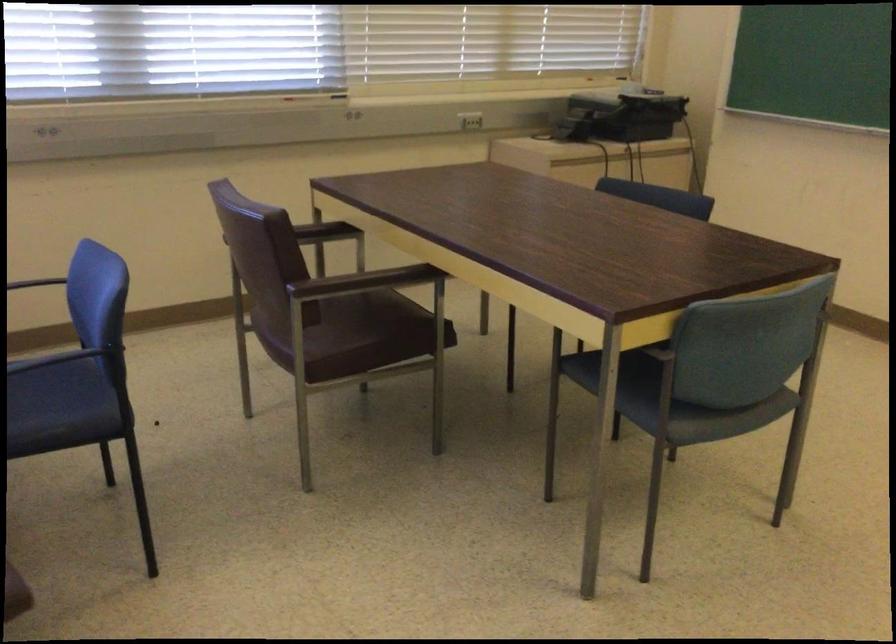
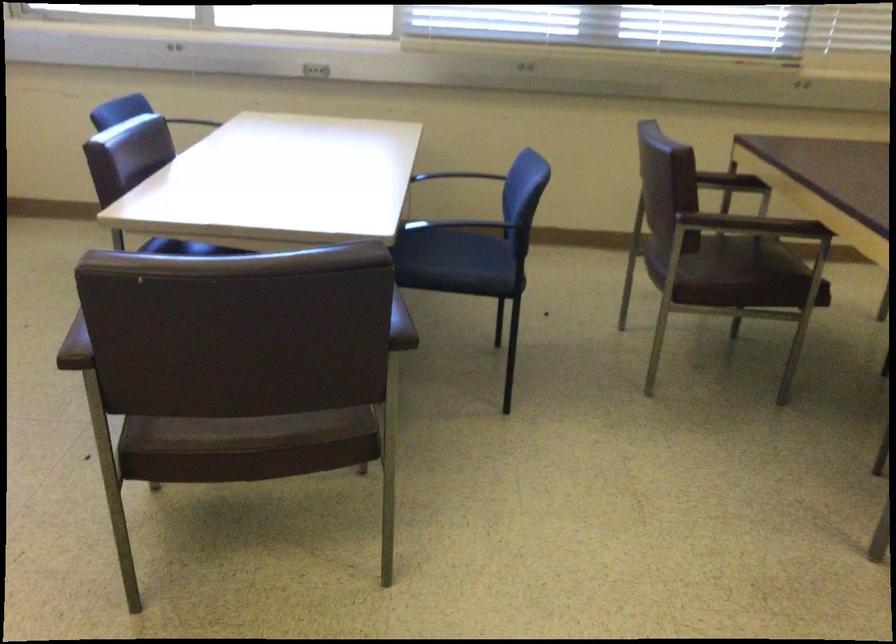
In the second image, find the point that corresponds to point (369, 339) in the first image.

(739, 278)